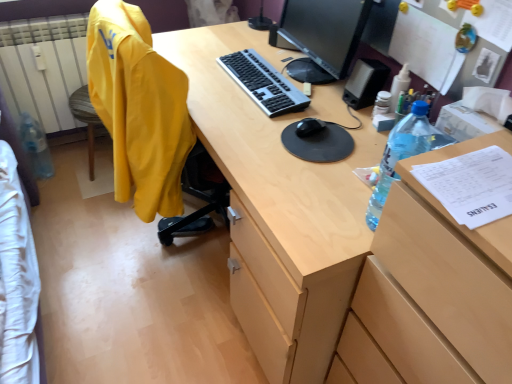
This screenshot has height=384, width=512. Find the location of `vacant area that is in front of black matte mouse at center`. vacant area that is in front of black matte mouse at center is located at coordinates (313, 152).